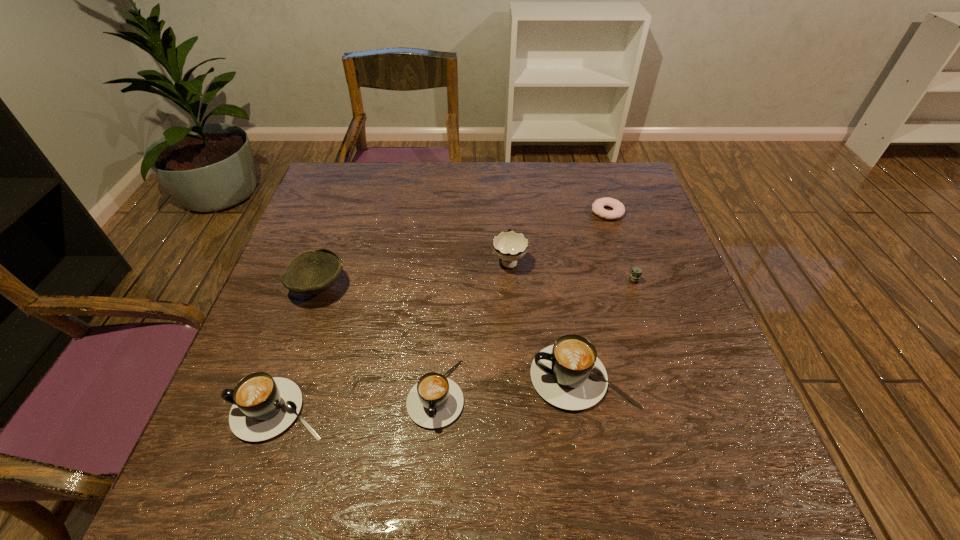
Where is `the leftmost cappuccino`? The image size is (960, 540). the leftmost cappuccino is located at coordinates (263, 407).

I want to click on the shortest cappuccino, so click(435, 401).

Locate an element on the screen. the third object from left to right is located at coordinates (435, 401).

Locate an element on the screen. The width and height of the screenshot is (960, 540). the rightmost cappuccino is located at coordinates coord(568,374).

This screenshot has width=960, height=540. I want to click on the farthest object, so pos(618,211).

You are a GUI agent. You are given a task and a screenshot of the screen. Output one action in this format:
    pyautogui.click(x=<x>, y=<y>)
    Task: Click on the shortest object
    
    Given the screenshot: What is the action you would take?
    pyautogui.click(x=618, y=211)

At what (x,y) coordinates should I click in order to perform the action: click on bowl. Please return your answer as a coordinate pair (x, y). Looking at the image, I should click on (312, 272).

This screenshot has height=540, width=960. I want to click on the second shortest object, so click(x=636, y=272).

At what (x,y) coordinates should I click in order to perform the action: click on cup. Please return your answer as a coordinate pair (x, y). The width and height of the screenshot is (960, 540). Looking at the image, I should click on [510, 246].

I want to click on vacant area situated with the handle on the side of the rightmost cappuccino, so click(x=335, y=377).